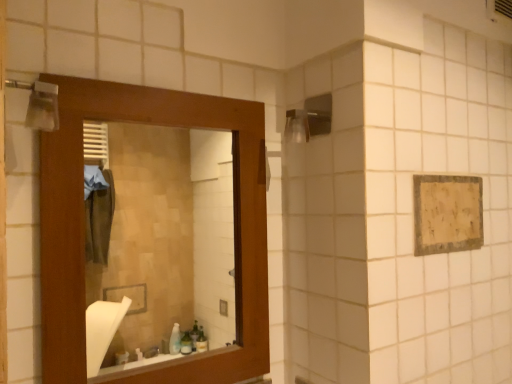
Question: From a real-world perspective, is wooden mirror at left beneath beige textured towel at upper right?

Choices:
 (A) no
 (B) yes

Answer: (B)

Question: Is wooden mirror at left at the left side of beige textured towel at upper right?

Choices:
 (A) no
 (B) yes

Answer: (B)

Question: Could you tell me if wooden mirror at left is turned towards beige textured towel at upper right?

Choices:
 (A) yes
 (B) no

Answer: (B)

Question: Does wooden mirror at left have a smaller size compared to beige textured towel at upper right?

Choices:
 (A) yes
 (B) no

Answer: (B)

Question: Is beige textured towel at upper right at the back of wooden mirror at left?

Choices:
 (A) no
 (B) yes

Answer: (A)

Question: Is wooden mirror at left shorter than beige textured towel at upper right?

Choices:
 (A) yes
 (B) no

Answer: (B)

Question: Can you confirm if beige textured towel at upper right is shorter than wooden mirror at left?

Choices:
 (A) yes
 (B) no

Answer: (A)

Question: Is beige textured towel at upper right thinner than wooden mirror at left?

Choices:
 (A) no
 (B) yes

Answer: (B)

Question: Can we say beige textured towel at upper right lies outside wooden mirror at left?

Choices:
 (A) yes
 (B) no

Answer: (A)

Question: Considering the relative sizes of beige textured towel at upper right and wooden mirror at left in the image provided, is beige textured towel at upper right smaller than wooden mirror at left?

Choices:
 (A) no
 (B) yes

Answer: (B)

Question: Is wooden mirror at left a part of beige textured towel at upper right?

Choices:
 (A) no
 (B) yes

Answer: (A)

Question: From the image's perspective, is beige textured towel at upper right located above wooden mirror at left?

Choices:
 (A) no
 (B) yes

Answer: (B)

Question: Considering the positions of beige textured towel at upper right and wooden mirror at left in the image, is beige textured towel at upper right taller or shorter than wooden mirror at left?

Choices:
 (A) short
 (B) tall

Answer: (A)